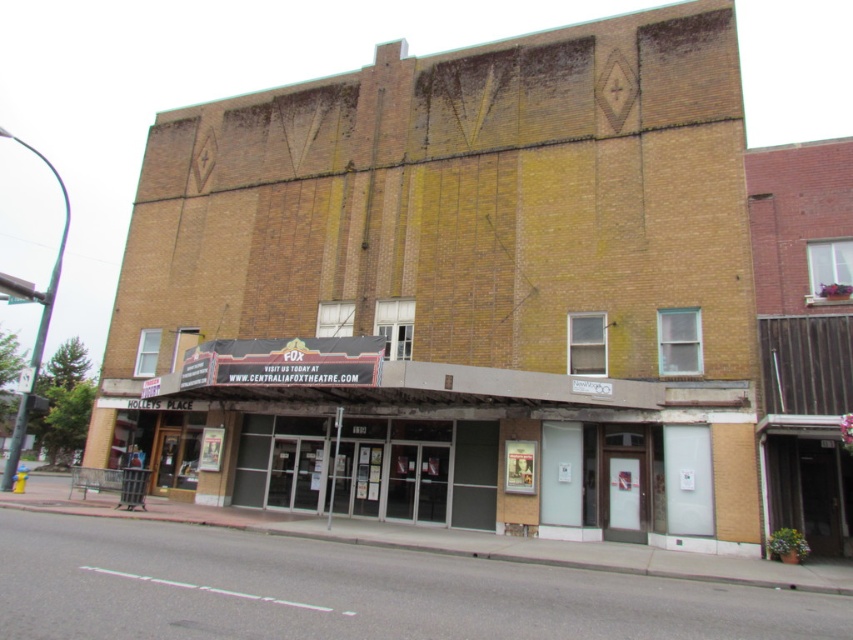
Can you confirm if brown brick theater at center is thinner than brick theater at center?

In fact, brown brick theater at center might be wider than brick theater at center.

Is brown brick theater at center smaller than brick theater at center?

Actually, brown brick theater at center might be larger than brick theater at center.

Image resolution: width=853 pixels, height=640 pixels. What do you see at coordinates (456, 291) in the screenshot?
I see `brown brick theater at center` at bounding box center [456, 291].

Image resolution: width=853 pixels, height=640 pixels. In order to click on brown brick theater at center in this screenshot , I will do [456, 291].